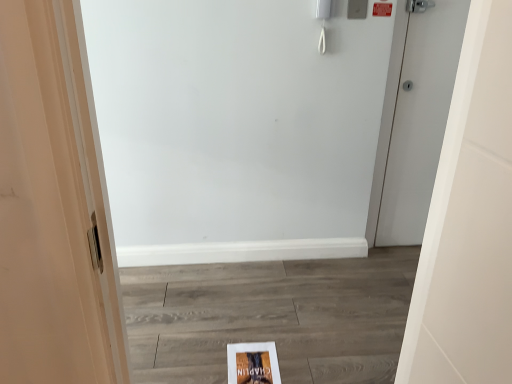
Question: Is matte paper flyer at center oriented away from white matte door at right?

Choices:
 (A) no
 (B) yes

Answer: (A)

Question: Does matte paper flyer at center have a lesser height compared to white matte door at right?

Choices:
 (A) yes
 (B) no

Answer: (A)

Question: Considering the relative positions of matte paper flyer at center and white matte door at right in the image provided, is matte paper flyer at center to the left of white matte door at right from the viewer's perspective?

Choices:
 (A) no
 (B) yes

Answer: (B)

Question: Are matte paper flyer at center and white matte door at right making contact?

Choices:
 (A) no
 (B) yes

Answer: (A)

Question: Could you tell me if matte paper flyer at center is turned towards white matte door at right?

Choices:
 (A) no
 (B) yes

Answer: (A)

Question: Does matte paper flyer at center appear on the right side of white matte door at right?

Choices:
 (A) yes
 (B) no

Answer: (B)

Question: From a real-world perspective, is white matte door at right physically below matte paper flyer at center?

Choices:
 (A) yes
 (B) no

Answer: (B)

Question: Is white matte door at right looking in the opposite direction of matte paper flyer at center?

Choices:
 (A) no
 (B) yes

Answer: (A)

Question: Is matte paper flyer at center inside white matte door at right?

Choices:
 (A) yes
 (B) no

Answer: (B)

Question: Does white matte door at right have a greater height compared to matte paper flyer at center?

Choices:
 (A) yes
 (B) no

Answer: (A)

Question: From the image's perspective, does white matte door at right appear higher than matte paper flyer at center?

Choices:
 (A) yes
 (B) no

Answer: (A)

Question: Can you confirm if white matte door at right is smaller than matte paper flyer at center?

Choices:
 (A) yes
 (B) no

Answer: (B)

Question: Looking at the image, does white matte door at right seem bigger or smaller compared to matte paper flyer at center?

Choices:
 (A) small
 (B) big

Answer: (B)